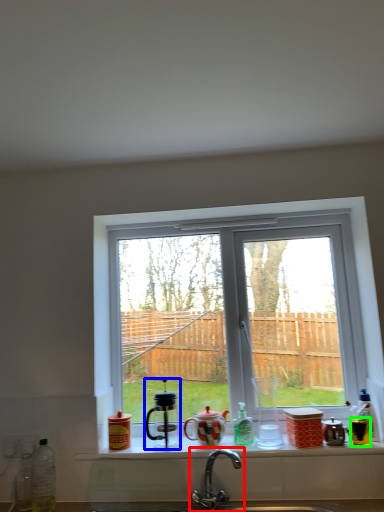
Question: Which is nearer to the tap (highlighted by a red box)? appliance (highlighted by a blue box) or appliance (highlighted by a green box).

Choices:
 (A) appliance
 (B) appliance

Answer: (A)